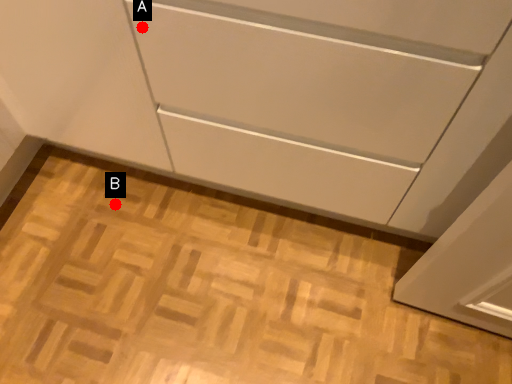
Question: Two points are circled on the image, labeled by A and B beside each circle. Which point is closer to the camera taking this photo?

Choices:
 (A) A is closer
 (B) B is closer

Answer: (A)